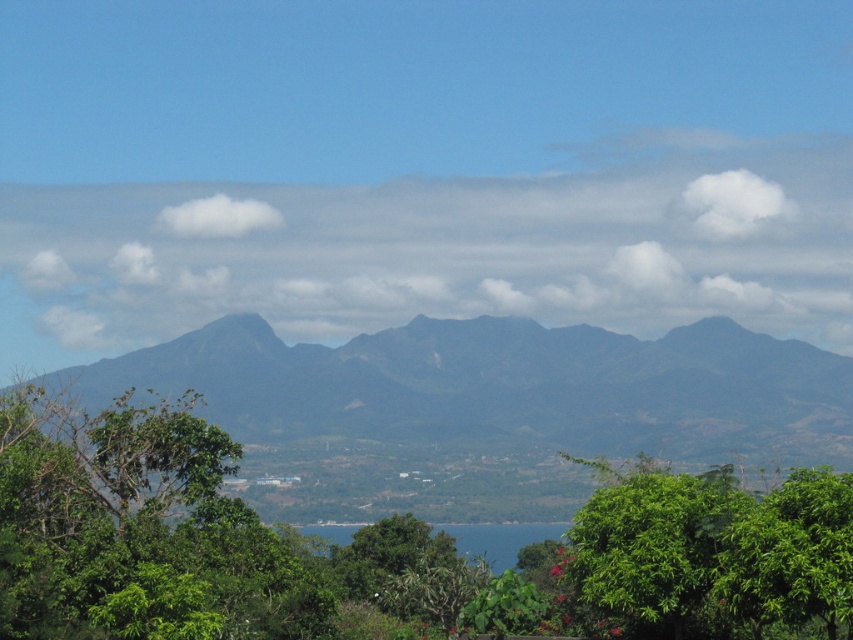
Is green leafy tree at lower left shorter than green leafy tree at lower right?

No.

Where is `green leafy tree at lower left`? green leafy tree at lower left is located at coordinates (138, 529).

Who is positioned more to the right, green matte mountain at center or blue water at lower center?

Positioned to the right is blue water at lower center.

What do you see at coordinates (486, 408) in the screenshot? I see `green matte mountain at center` at bounding box center [486, 408].

The height and width of the screenshot is (640, 853). Find the location of `green matte mountain at center`. green matte mountain at center is located at coordinates (486, 408).

Which is more to the left, green leafy tree at center or green leafy tree at lower left?

From the viewer's perspective, green leafy tree at lower left appears more on the left side.

Looking at this image, can you confirm if green leafy tree at center is positioned to the right of green leafy tree at lower left?

Indeed, green leafy tree at center is positioned on the right side of green leafy tree at lower left.

Is point (265, 560) closer to viewer compared to point (170, 502)?

Yes, it is.

You are a GUI agent. You are given a task and a screenshot of the screen. Output one action in this format:
    pyautogui.click(x=<x>, y=<y>)
    Task: Click on the green leafy tree at center
    Image resolution: width=853 pixels, height=640 pixels.
    Given the screenshot: What is the action you would take?
    pyautogui.click(x=378, y=547)